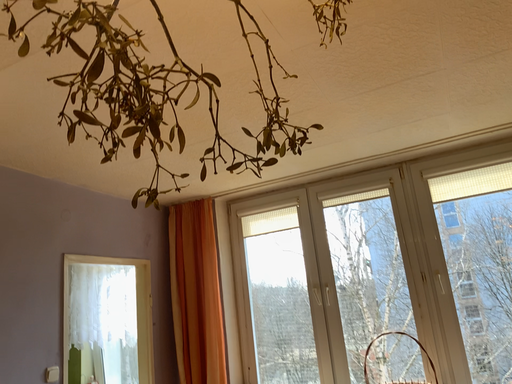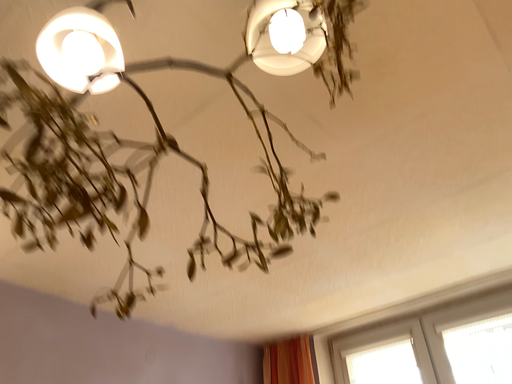
Question: How did the camera likely rotate when shooting the video?

Choices:
 (A) rotated right
 (B) rotated left

Answer: (B)